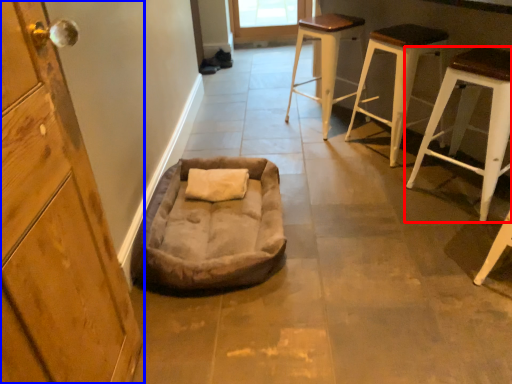
Question: Which object is closer to the camera taking this photo, stool (highlighted by a red box) or cabinetry (highlighted by a blue box)?

Choices:
 (A) stool
 (B) cabinetry

Answer: (B)